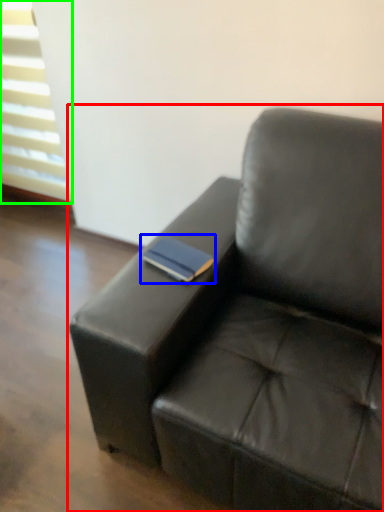
Question: Considering the real-world distances, which object is closest to studio couch (highlighted by a red box)? paperback book (highlighted by a blue box) or window (highlighted by a green box).

Choices:
 (A) paperback book
 (B) window

Answer: (A)